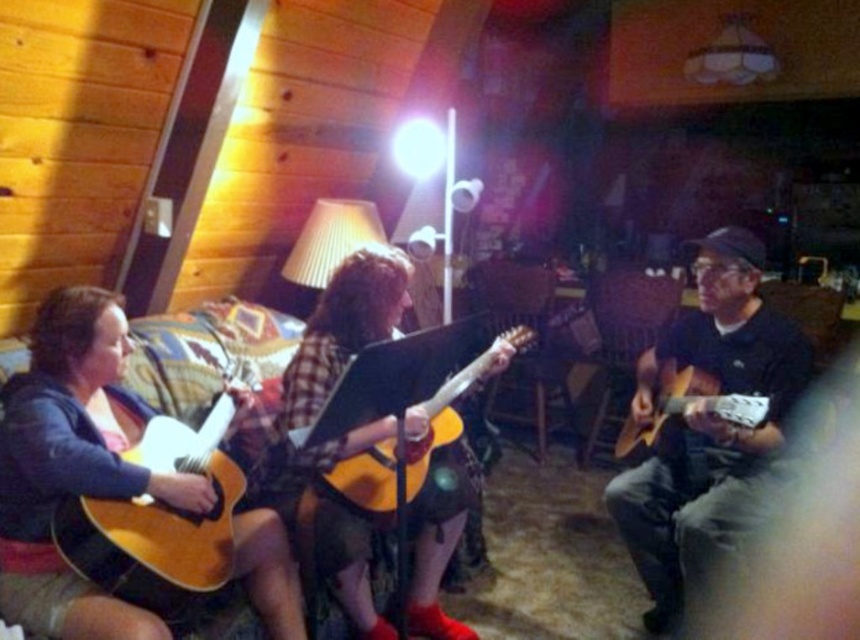
In the scene shown: You are standing in the cabin and want to place a new decorative item exactly where the wooden acoustic guitar at center is currently located. According to the coordinates provided, what are the exact coordinates where you should place the decorative item?

The exact coordinates where you should place the decorative item are at point (344,326), which is the same as the wooden acoustic guitar at center.

Consider the image. You are standing in the cabin and want to take a photo of the point at coordinates (364, 321). The camera you have can focus on objects up to 2.5 meters away. Will the point be in focus?

The point at coordinates (364, 321) is 2.45 meters away from the camera, which is within the 2.5 meters focusing range. Therefore, the point will be in focus.

You are a photographer setting up for a group photo in this cabin scene. You need to position a spotlight to the right of both the matte brown guitar at left and the matte wood guitar at left. Can you confirm if there is enough space between them to place the spotlight?

The matte brown guitar at left is to the left of the matte wood guitar at left, so placing a spotlight to the right of both would require positioning it beyond the matte wood guitar at left. There should be sufficient space as the spotlight only needs to be placed to the right of the rightmost guitar, which is the matte wood guitar at left.